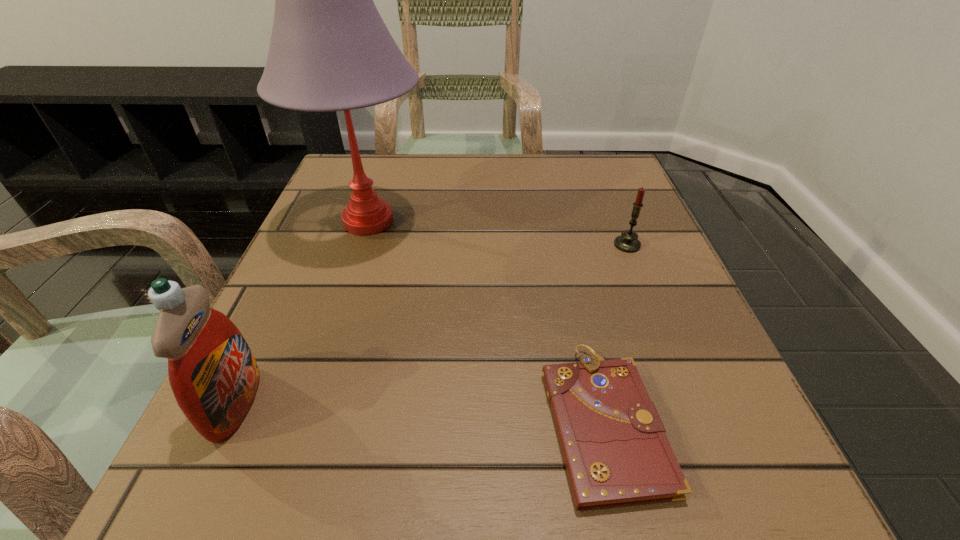
At what (x,y) coordinates should I click in order to perform the action: click on free area in between the notebook and the detergent. Please return your answer as a coordinate pair (x, y). The height and width of the screenshot is (540, 960). Looking at the image, I should click on (419, 411).

Where is `free spot between the shortest object and the table lamp`? The width and height of the screenshot is (960, 540). free spot between the shortest object and the table lamp is located at coordinates (486, 320).

Locate an element on the screen. free spot between the tallest object and the notebook is located at coordinates (486, 320).

Image resolution: width=960 pixels, height=540 pixels. Identify the location of vacant area that lies between the table lamp and the rightmost object. (497, 233).

Find the location of a particular element. The image size is (960, 540). free space between the table lamp and the third tallest object is located at coordinates (497, 233).

In order to click on empty space that is in between the table lamp and the notebook in this screenshot , I will do `click(486, 320)`.

This screenshot has height=540, width=960. I want to click on the second closest object to the detergent, so click(x=616, y=453).

Find the location of a particular element. object that is the closest one to the detergent is located at coordinates (330, 50).

The height and width of the screenshot is (540, 960). I want to click on free location that satisfies the following two spatial constraints: 1. on the front surface of the third object from left to right; 2. on the right side of the second tallest object, so click(x=228, y=420).

The image size is (960, 540). I want to click on free location that satisfies the following two spatial constraints: 1. on the front surface of the shortest object; 2. on the left side of the third shortest object, so click(228, 420).